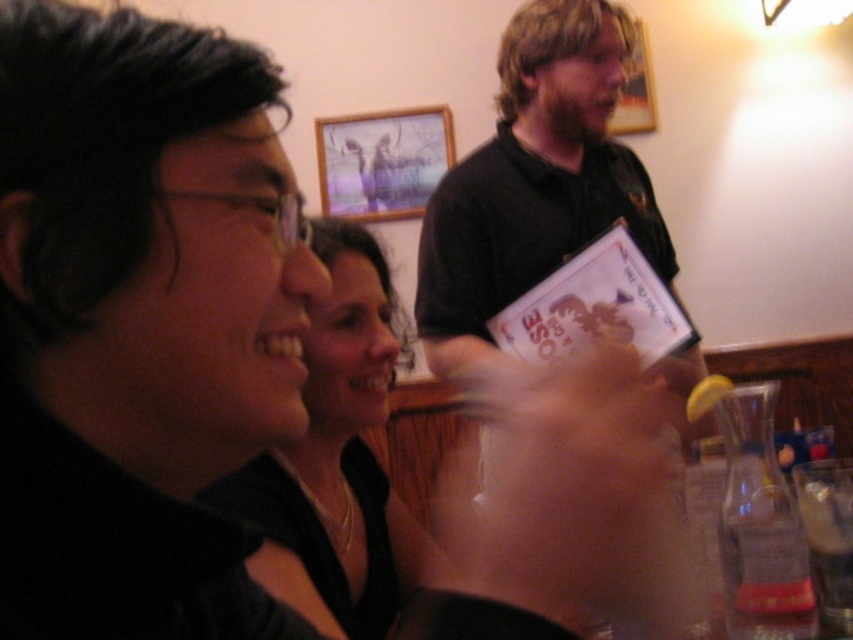
You are a guest at this event and want to locate the white paper card at center. Where should you look relative to the seated individuals?

The white paper card at center is located at point coordinates of [596,307]. Since the seated individuals are in the foreground, the white paper card at center is likely positioned slightly behind them, near the central area of the scene.

You are at a social gathering and want to move from the point at coordinates point (x=567, y=294) to the point at coordinates point (x=357, y=154). Can you walk directly towards it without needing to go around any obstacles?

Point (x=567, y=294) is in front of point (x=357, y=154), so you can walk directly towards it without needing to go around any obstacles.